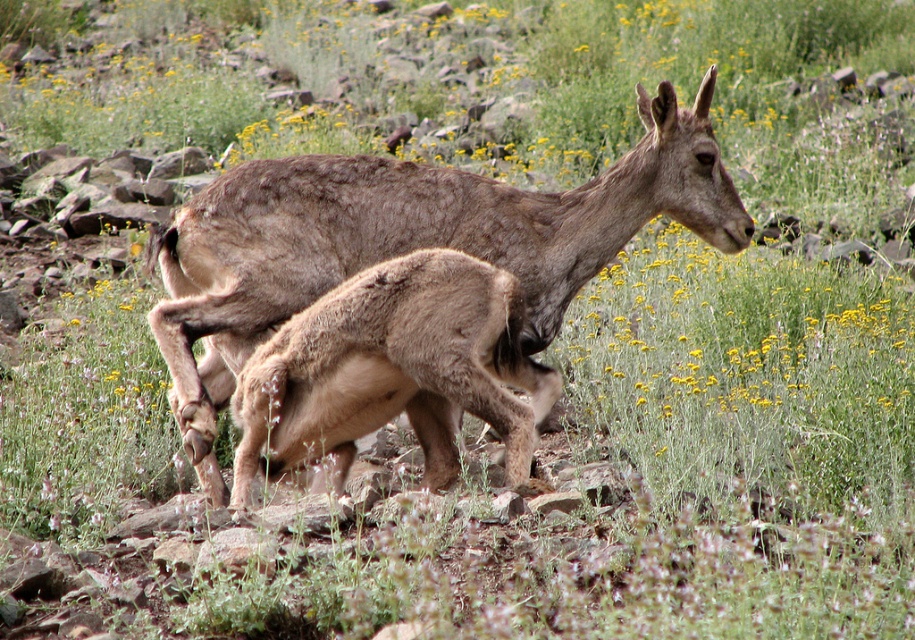
You are a wildlife photographer observing the two bighorn sheep in the scene. You want to capture a photo of the adult female and her lamb. You have two camera positions marked as point A at coordinates point (228, 237) and point B at coordinates point (371, 424). Which point should you choose to ensure the adult female is positioned behind the lamb in the photo?

Point A at coordinates point (228, 237) should be chosen because point (228, 237) is behind point (371, 424). This means that from point A, the adult female will appear behind the lamb in the photo.

You are a wildlife photographer aiming to capture a closeup shot of the brown woolen deer at center and the brown woolen baby deer at center. Given their sizes, which deer would you need to adjust your camera settings for to ensure proper focus?

The brown woolen deer at center is larger than the brown woolen baby deer at center, so you should adjust your camera settings to focus on the smaller brown woolen baby deer at center to ensure clarity.